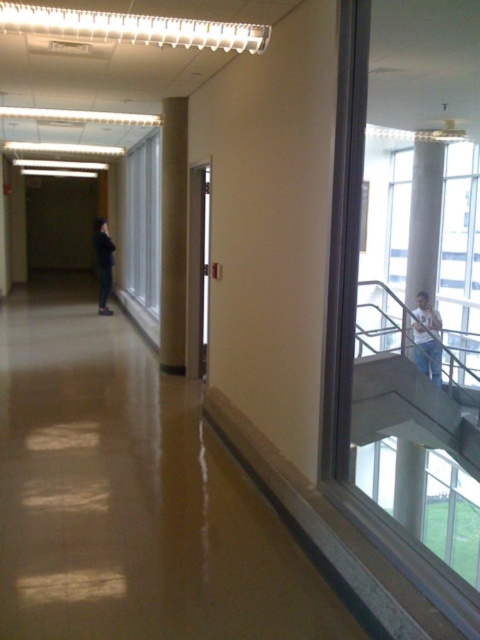
Is white cotton shirt at upper right thinner than black matte jacket at left?

Incorrect, white cotton shirt at upper right's width is not less than black matte jacket at left's.

Is point (421, 310) in front of point (101, 234)?

No, (421, 310) is further to viewer.

The width and height of the screenshot is (480, 640). What do you see at coordinates (427, 339) in the screenshot?
I see `white cotton shirt at upper right` at bounding box center [427, 339].

Find the location of a particular element. white cotton shirt at upper right is located at coordinates (427, 339).